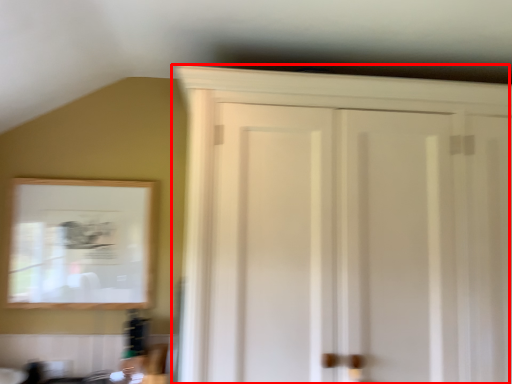
Question: From the image, what is the correct spatial relationship of cupboard (annotated by the red box) in relation to mirror?

Choices:
 (A) right
 (B) left

Answer: (A)